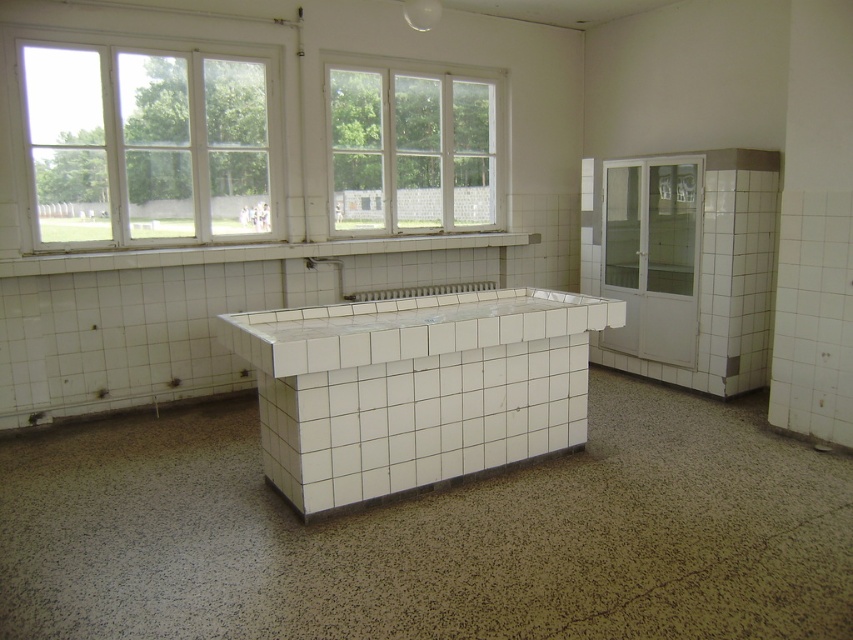
Is point (202, 64) farther from viewer compared to point (453, 109)?

No, (202, 64) is in front of (453, 109).

Between point (276, 193) and point (473, 138), which one is positioned in front?

Positioned in front is point (276, 193).

Is point (229, 161) farther from viewer compared to point (354, 234)?

No, it is not.

Where is `clear glass window at upper left`? The height and width of the screenshot is (640, 853). clear glass window at upper left is located at coordinates (148, 145).

Who is higher up, clear glass window at upper left or white glossy counter top at center?

Positioned higher is clear glass window at upper left.

Locate an element on the screen. This screenshot has height=640, width=853. clear glass window at upper left is located at coordinates (148, 145).

Can you confirm if white tile counter at center is taller than white glass window at upper center?

No, white tile counter at center is not taller than white glass window at upper center.

Does point (328, 417) lie in front of point (357, 204)?

Yes, it is.

At what (x,y) coordinates should I click in order to perform the action: click on white tile counter at center. Please return your answer as a coordinate pair (x, y). Looking at the image, I should click on (415, 387).